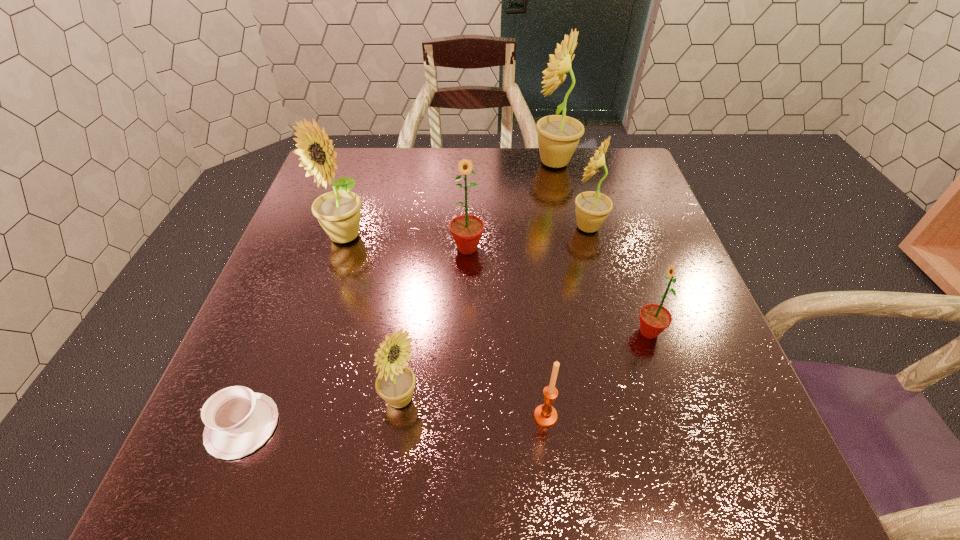
Identify the location of the third closest yellow sunflower relative to the shortest object. The height and width of the screenshot is (540, 960). (592, 208).

Locate an element on the screen. free region that satisfies the following two spatial constraints: 1. on the face of the farther green sunflower; 2. on the handle side of the teacup is located at coordinates pyautogui.click(x=462, y=426).

Find the location of `vacant space that satisfies the following two spatial constraints: 1. on the face of the second tallest object; 2. on the handle side of the teacup`. vacant space that satisfies the following two spatial constraints: 1. on the face of the second tallest object; 2. on the handle side of the teacup is located at coordinates (283, 426).

Identify the location of free space that satisfies the following two spatial constraints: 1. on the face of the candle_holder; 2. on the right side of the fourth object from left to right. (463, 416).